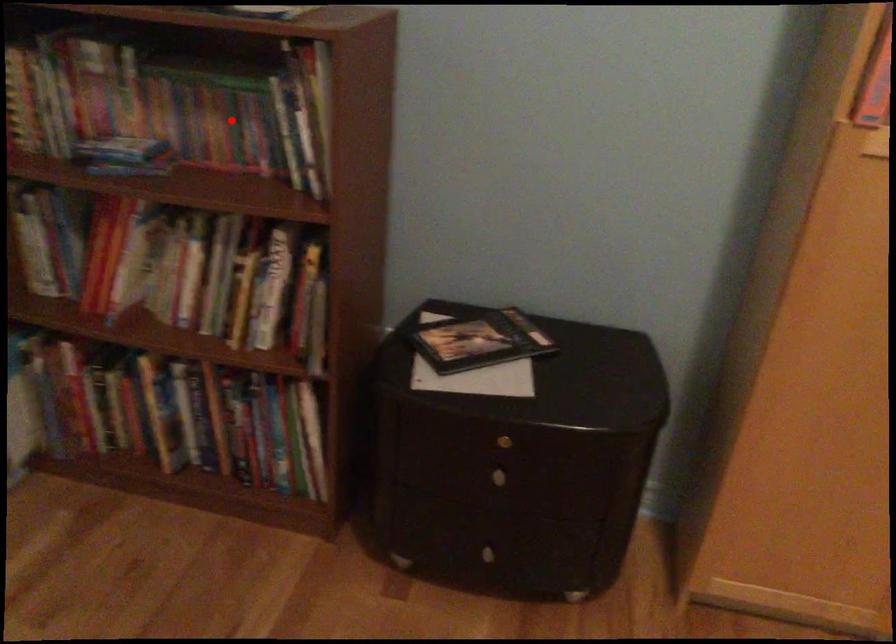
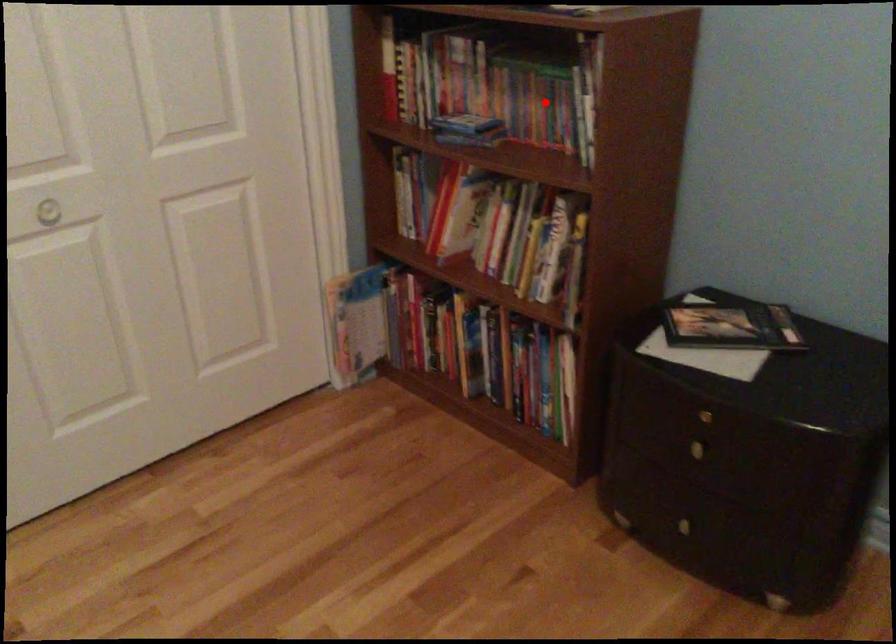
I am providing you with two images of the same scene from different viewpoints. A red point is marked on the first image and another point is marked on the second image. Does the point marked in image1 correspond to the same location as the one in image2?

Yes